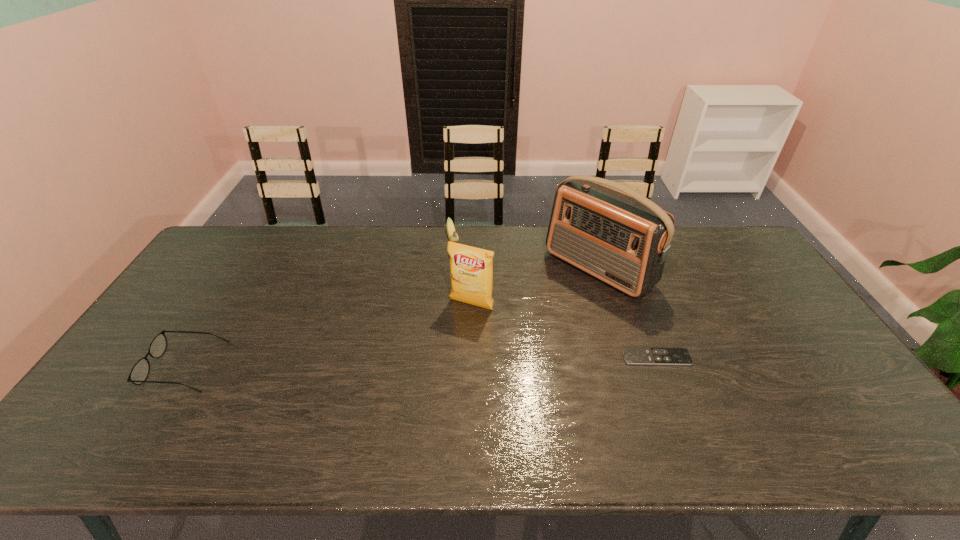
The image size is (960, 540). I want to click on object at the left edge, so click(x=140, y=371).

The image size is (960, 540). In order to click on object that is positioned at the near left corner in this screenshot , I will do `click(140, 371)`.

Image resolution: width=960 pixels, height=540 pixels. In order to click on vacant area at the far edge in this screenshot , I will do `click(687, 255)`.

Locate an element on the screen. The height and width of the screenshot is (540, 960). free location at the near edge is located at coordinates (482, 408).

I want to click on blank region between the third shortest object and the leftmost object, so click(319, 303).

At what (x,y) coordinates should I click in order to perform the action: click on free space between the radio receiver and the shortest object. Please return your answer as a coordinate pair (x, y). The height and width of the screenshot is (540, 960). Looking at the image, I should click on (627, 313).

The width and height of the screenshot is (960, 540). In order to click on free space between the tallest object and the remote control in this screenshot , I will do `click(627, 313)`.

You are a GUI agent. You are given a task and a screenshot of the screen. Output one action in this format:
    pyautogui.click(x=<x>, y=<y>)
    Task: Click on the vacant space in between the radio receiver and the fourth shortest object
    This screenshot has width=960, height=540.
    Given the screenshot: What is the action you would take?
    pyautogui.click(x=535, y=287)

Where is `vacant space in between the tallest object and the second tallest object`? The height and width of the screenshot is (540, 960). vacant space in between the tallest object and the second tallest object is located at coordinates (535, 287).

Locate an element on the screen. vacant space in between the fourth tallest object and the shortest object is located at coordinates (420, 362).